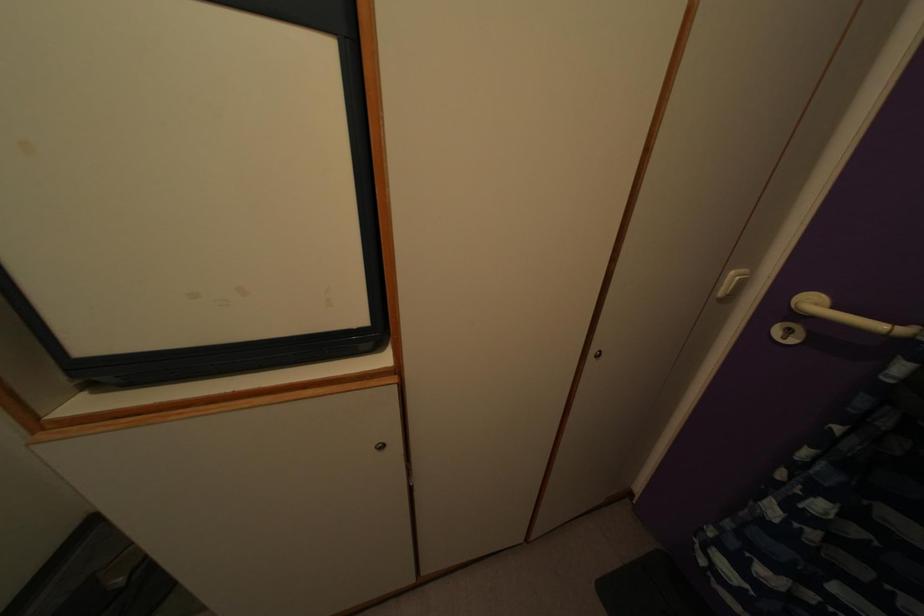
Identify the location of white door handle. (847, 315).